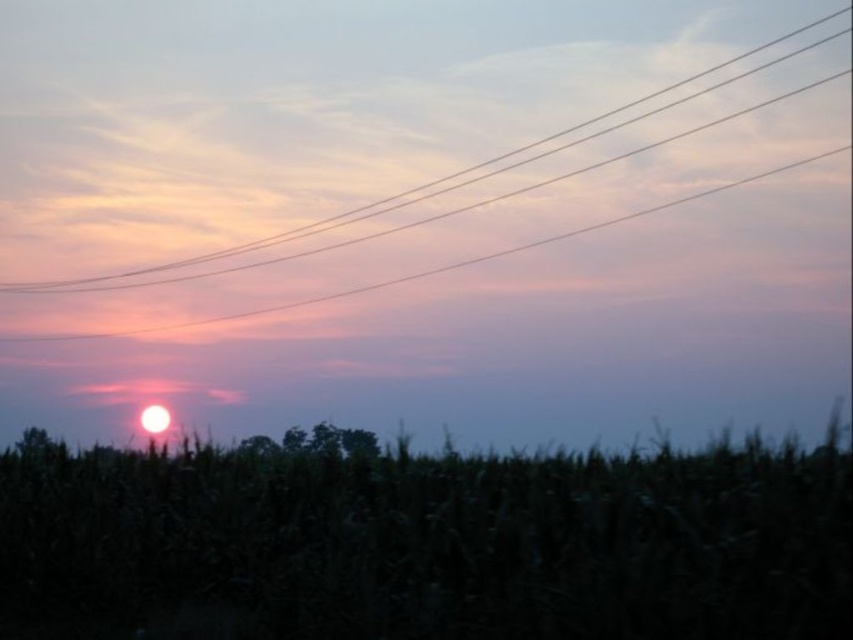
You are a bird flying over the sunset scene. You see the green matte corn field at lower center and the clear wire at upper center. Which object is closer to the ground?

The green matte corn field at lower center is closer to the ground than the clear wire at upper center.

Based on the photo, you are a bird flying over the sunset scene. You need to land on the green matte corn field at lower center but avoid the clear wire at upper center. Which object should you aim for first based on their sizes?

The green matte corn field at lower center has a larger width than the clear wire at upper center, so you should aim for the green matte corn field at lower center first as it offers a wider landing area.

You are a drone operator preparing to fly a drone with a wingspan of 2 meters. You need to navigate between the green matte corn field at lower center and the clear wire at upper center. Can the drone safely pass through the space between them without colliding?

The distance between the green matte corn field at lower center and the clear wire at upper center is 7.98 meters. Since the drone has a wingspan of 2 meters, there is sufficient space for it to pass safely through the gap without collision.